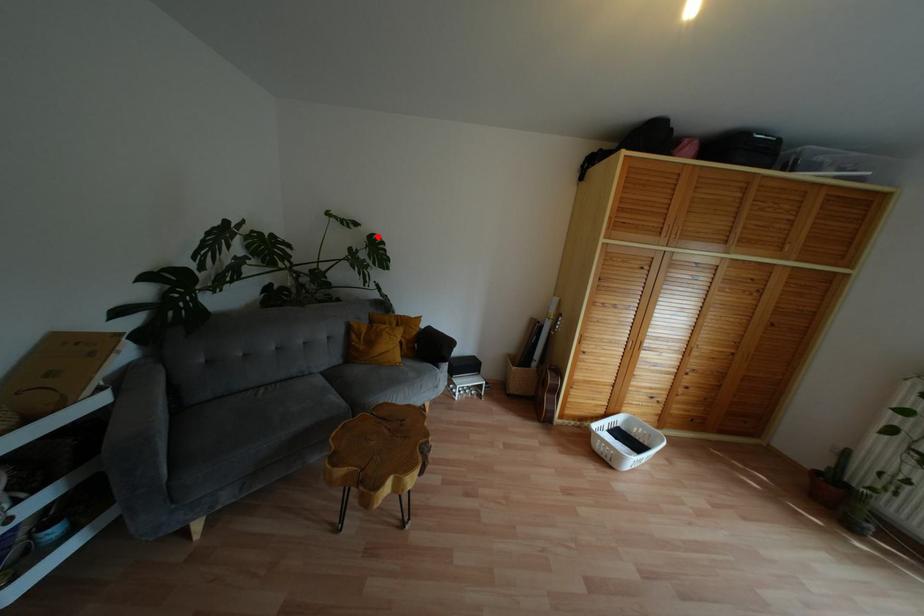
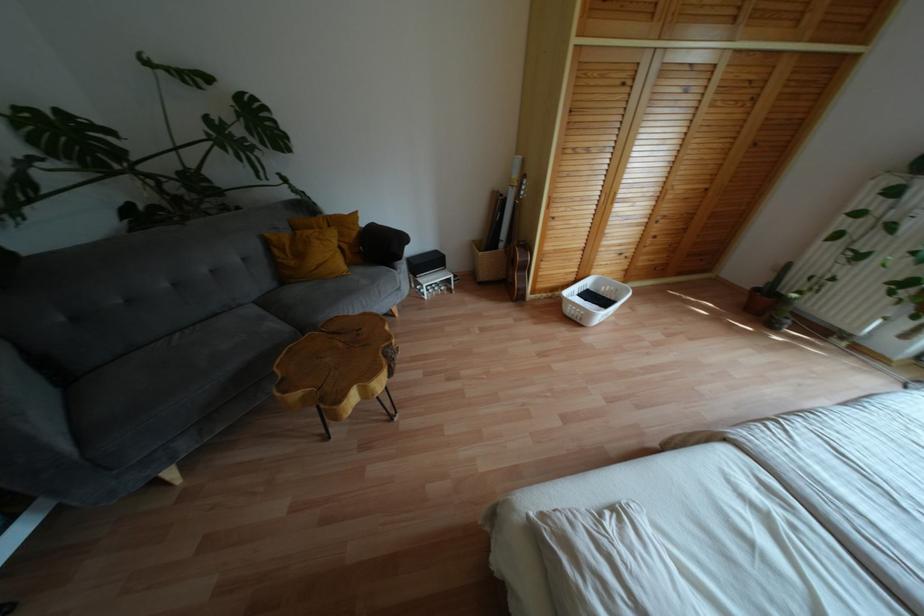
The point at the highlighted location is marked in the first image. Where is the corresponding point in the second image?

(253, 98)